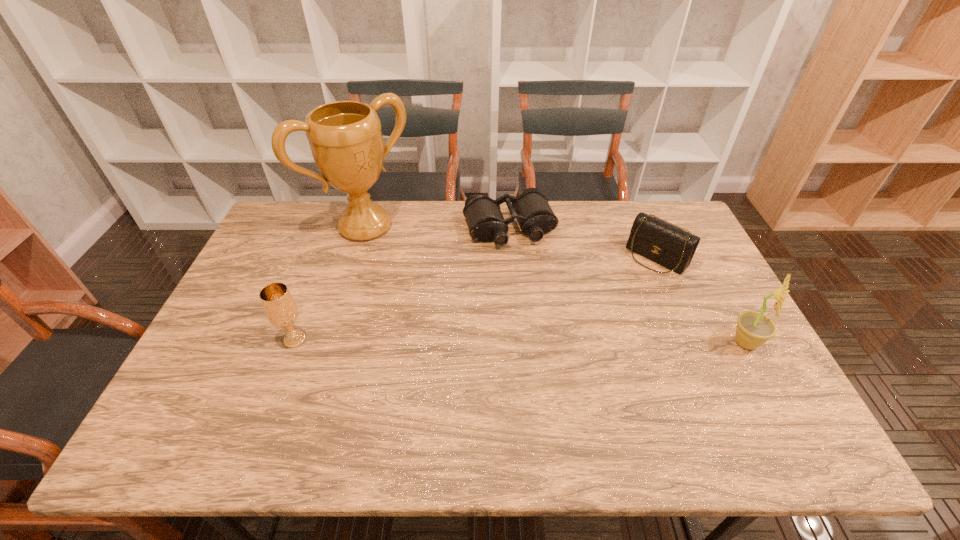
What are the coordinates of `free spot on the desktop that is between the chalice and the second tallest object and is positioned through the eyepieces of the third object from right to left` in the screenshot? It's located at (557, 342).

Where is `free spot on the desktop that is between the third tallest object and the sunflower and is positioned on the front of the award with the decoration`? The image size is (960, 540). free spot on the desktop that is between the third tallest object and the sunflower and is positioned on the front of the award with the decoration is located at coordinates (477, 341).

Identify the location of vacant spot on the desktop that is between the chalice and the rightmost object and is positioned on the front flap of the second shortest object. The image size is (960, 540). point(574,342).